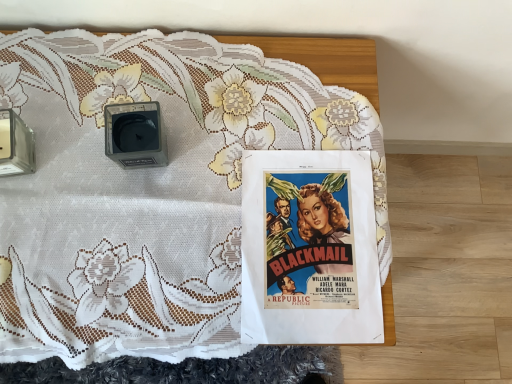
The image size is (512, 384). Find the location of `vacant area to the left of matte black alarm clock at upper left`. vacant area to the left of matte black alarm clock at upper left is located at coordinates (58, 123).